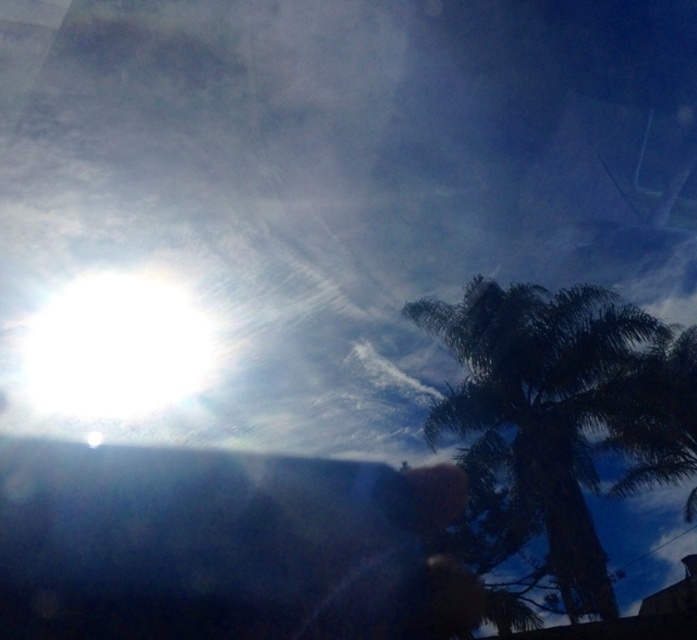
Question: Can you confirm if green leafy palm tree at upper right is positioned to the right of white glossy sun at upper left?

Choices:
 (A) no
 (B) yes

Answer: (B)

Question: Can you confirm if green leafy palm tree at upper right is positioned to the left of white glossy sun at upper left?

Choices:
 (A) yes
 (B) no

Answer: (B)

Question: Can you confirm if green leafy palm tree at upper right is thinner than white glossy sun at upper left?

Choices:
 (A) no
 (B) yes

Answer: (A)